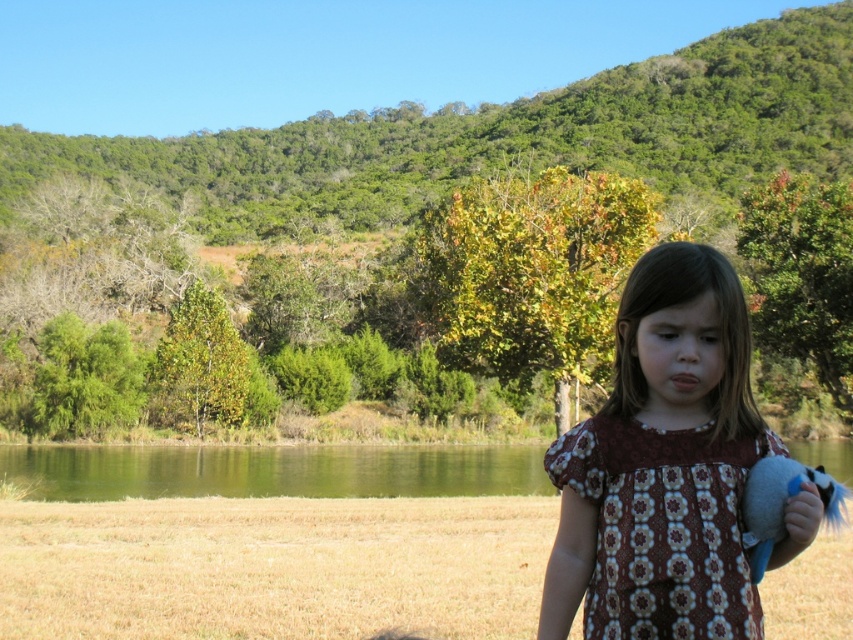
You are a photographer trying to capture the girl and the objects in the scene. You need to ensure both the green liquid water at lower center and the fluffy plush toy at lower right are clearly visible in your shot. Which object should you focus on first to ensure it doesn t get too small in the frame?

You should focus on the green liquid water at lower center first because it is larger in size than the fluffy plush toy at lower right, so it will remain more visible even if the framing changes slightly.

You are a photographer planning to take a photo of the green liquid water at lower center and the fluffy plush toy at lower right. Which object should you focus on first if you want to ensure both are in focus, considering their heights?

The green liquid water at lower center has a greater height compared to the fluffy plush toy at lower right, so you should focus on the green liquid water at lower center first to ensure both are in focus.

In the scene shown: You are a photographer standing at the edge of a grassy field near a body of water. You want to capture a photo of the green liquid water at lower center without including the young girl in the frame. Is the distance sufficient to zoom in and focus on the water while excluding the girl?

The green liquid water at lower center is 31.08 meters away from the camera. Since the distance is relatively far, you can zoom in to focus on the water while excluding the girl in the foreground.